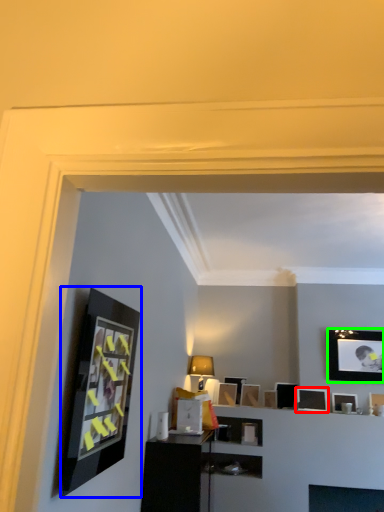
Question: Based on their relative distances, which object is farther from picture frame (highlighted by a red box)? Choose from picture frame (highlighted by a blue box) and picture frame (highlighted by a green box).

Choices:
 (A) picture frame
 (B) picture frame

Answer: (A)